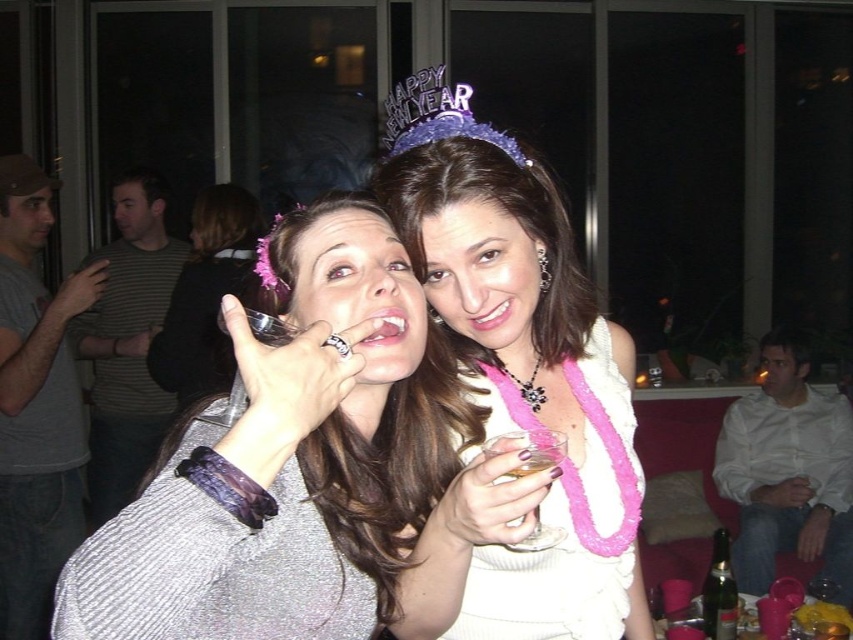
You are at a New Year party and want to show off your shiny silver ring at center and clear glass wine glass at center to your friends. Which of the two items is bigger?

The shiny silver ring at center is larger in size than the clear glass wine glass at center.

You are a photographer standing at the center of the room. You want to take a photo of both the sparkly white dress at center and the shiny silver ring at center. The minimum distance required for your camera to focus on both objects clearly is 5 feet. Will you be able to capture both objects in focus?

The sparkly white dress at center is 4.86 feet away from the shiny silver ring at center. Since the distance between them is less than the required 5 feet, the camera can focus on both objects clearly.